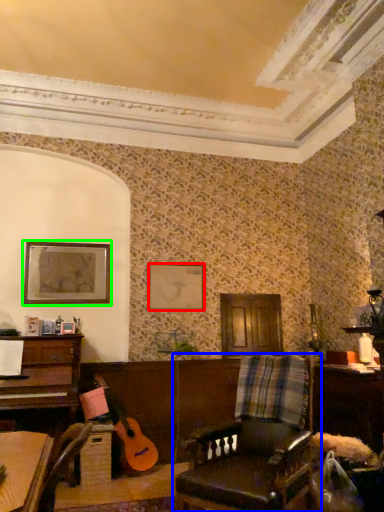
Question: Estimate the real-world distances between objects in this image. Which object is closer to picture frame (highlighted by a red box), chair (highlighted by a blue box) or picture frame (highlighted by a green box)?

Choices:
 (A) chair
 (B) picture frame

Answer: (B)